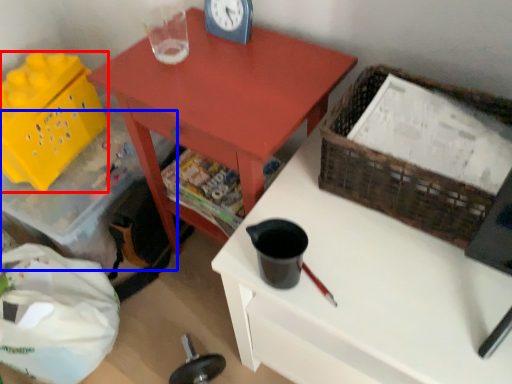
Question: Among these objects, which one is nearest to the camera, basket (highlighted by a red box) or storage box (highlighted by a blue box)?

Choices:
 (A) basket
 (B) storage box

Answer: (A)